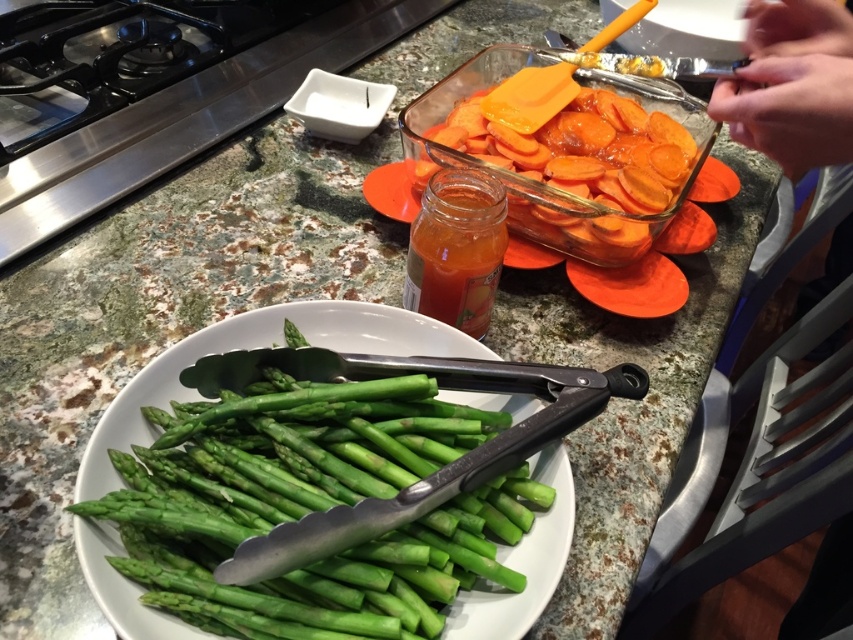
Is smooth skin hands at upper right to the left of translucent glass jar at center from the viewer's perspective?

No, smooth skin hands at upper right is not to the left of translucent glass jar at center.

Is smooth skin hands at upper right below translucent glass jar at center?

Incorrect, smooth skin hands at upper right is not positioned below translucent glass jar at center.

Between point (757, 60) and point (457, 296), which one is positioned in front?

Point (757, 60) is in front.

Identify the location of smooth skin hands at upper right. The image size is (853, 640). (792, 84).

Between point (592, 204) and point (467, 250), which one is positioned behind?

The point (592, 204) is behind.

Which of these two, orange glazed carrots at center or translucent glass jar at center, stands taller?

Standing taller between the two is orange glazed carrots at center.

Between point (639, 232) and point (498, 196), which one is positioned behind?

Point (639, 232)

Where is `orange glazed carrots at center`? The image size is (853, 640). orange glazed carrots at center is located at coordinates (550, 184).

Locate an element on the screen. green matte asparagus at center is located at coordinates (258, 348).

Does point (358, 314) come in front of point (534, 198)?

Yes, point (358, 314) is closer to viewer.

Locate an element on the screen. green matte asparagus at center is located at coordinates (258, 348).